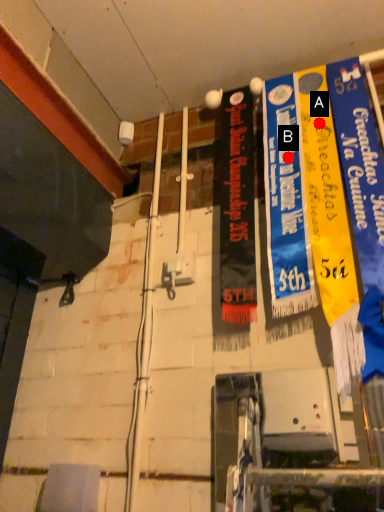
Question: Two points are circled on the image, labeled by A and B beside each circle. Which point is farther from the camera taking this photo?

Choices:
 (A) A is further
 (B) B is further

Answer: (A)